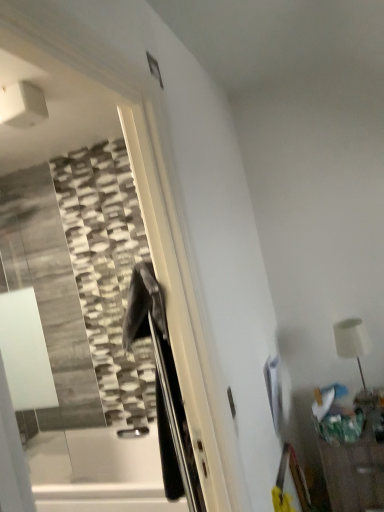
Question: Could white matte table lamp at right be considered to be inside wooden table at lower right?

Choices:
 (A) no
 (B) yes

Answer: (A)

Question: Can you confirm if wooden table at lower right is bigger than white matte table lamp at right?

Choices:
 (A) no
 (B) yes

Answer: (B)

Question: Is the depth of wooden table at lower right less than that of white matte table lamp at right?

Choices:
 (A) yes
 (B) no

Answer: (A)

Question: From a real-world perspective, is wooden table at lower right located beneath white matte table lamp at right?

Choices:
 (A) no
 (B) yes

Answer: (B)

Question: Is wooden table at lower right to the left of white matte table lamp at right from the viewer's perspective?

Choices:
 (A) yes
 (B) no

Answer: (B)

Question: Does wooden table at lower right have a lesser height compared to white matte table lamp at right?

Choices:
 (A) no
 (B) yes

Answer: (A)

Question: Can you confirm if white matte table lamp at right is wider than wooden table at lower right?

Choices:
 (A) no
 (B) yes

Answer: (A)

Question: From the image's perspective, is white matte table lamp at right on top of wooden table at lower right?

Choices:
 (A) no
 (B) yes

Answer: (B)

Question: Is white matte table lamp at right positioned with its back to wooden table at lower right?

Choices:
 (A) no
 (B) yes

Answer: (A)

Question: Can we say white matte table lamp at right lies outside wooden table at lower right?

Choices:
 (A) no
 (B) yes

Answer: (B)

Question: Considering the relative sizes of white matte table lamp at right and wooden table at lower right in the image provided, is white matte table lamp at right shorter than wooden table at lower right?

Choices:
 (A) no
 (B) yes

Answer: (B)

Question: Is the depth of white matte table lamp at right greater than that of wooden table at lower right?

Choices:
 (A) yes
 (B) no

Answer: (A)

Question: Considering the positions of white matte table lamp at right and wooden table at lower right in the image, is white matte table lamp at right wider or thinner than wooden table at lower right?

Choices:
 (A) thin
 (B) wide

Answer: (A)